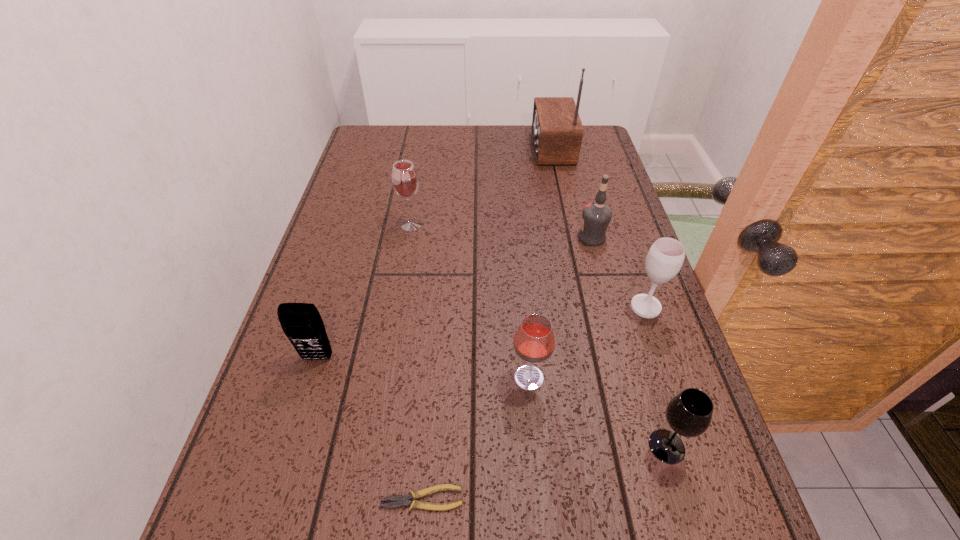
This screenshot has height=540, width=960. In order to click on the farthest object in this screenshot , I will do `click(557, 131)`.

Locate an element on the screen. radio receiver is located at coordinates (557, 131).

Find the location of a particular element. The height and width of the screenshot is (540, 960). vodka is located at coordinates 596,216.

Find the location of a particular element. The height and width of the screenshot is (540, 960). the farthest wineglass is located at coordinates (405, 182).

Where is `the third nearest wineglass`? This screenshot has height=540, width=960. the third nearest wineglass is located at coordinates (665, 258).

I want to click on the fifth object from right to left, so click(x=534, y=342).

Locate an element on the screen. This screenshot has width=960, height=540. the second nearest wineglass is located at coordinates (534, 342).

Where is `the leftmost object`? the leftmost object is located at coordinates (301, 322).

I want to click on the seventh farthest object, so click(x=689, y=413).

Identify the location of the shortest object. The image size is (960, 540). (401, 500).